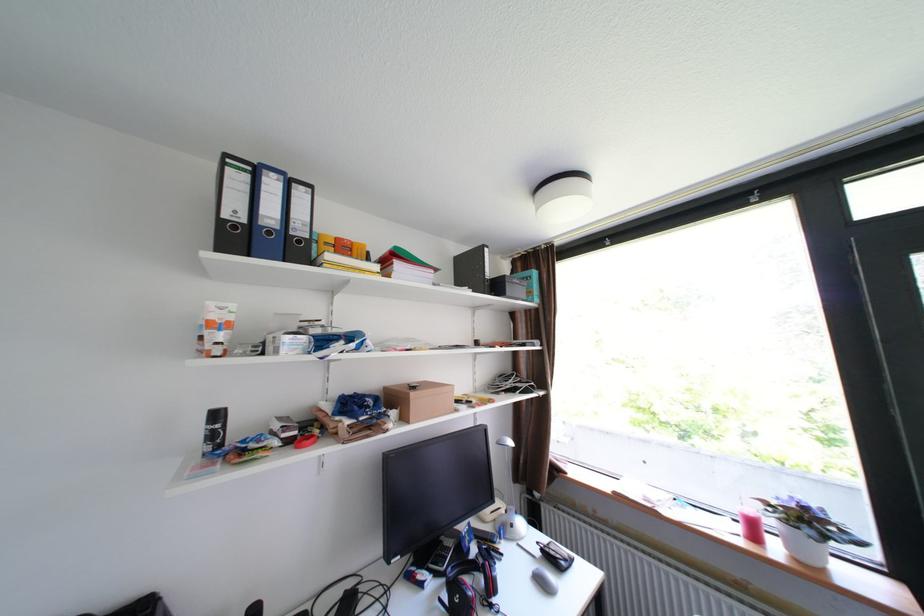
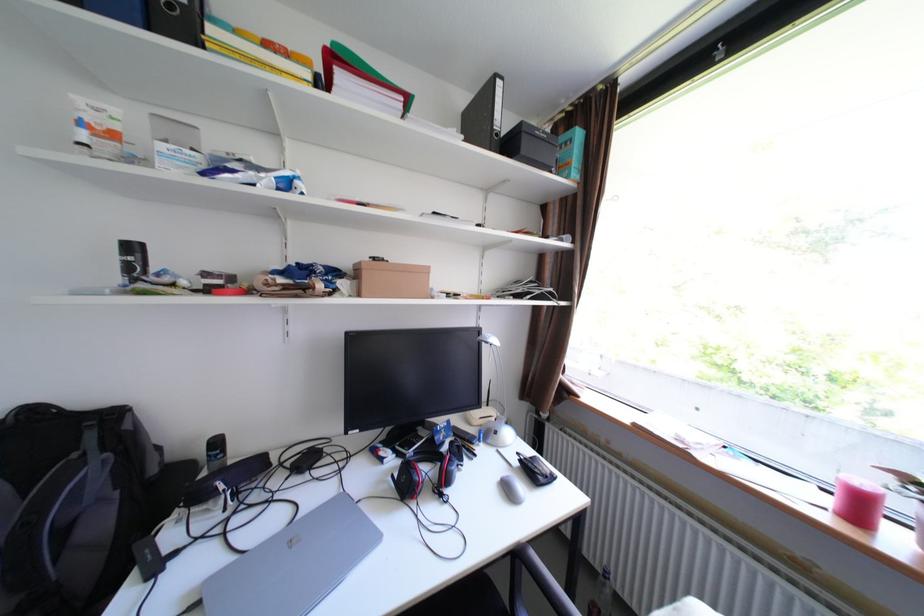
Find the pixel in the second image that matches (x=407, y=265) in the first image.

(351, 76)